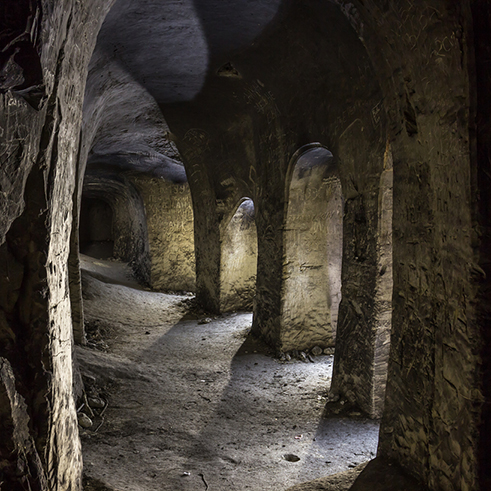
Identify the location of wall betwen arches on right. (445, 203), (361, 189), (267, 188), (219, 190).